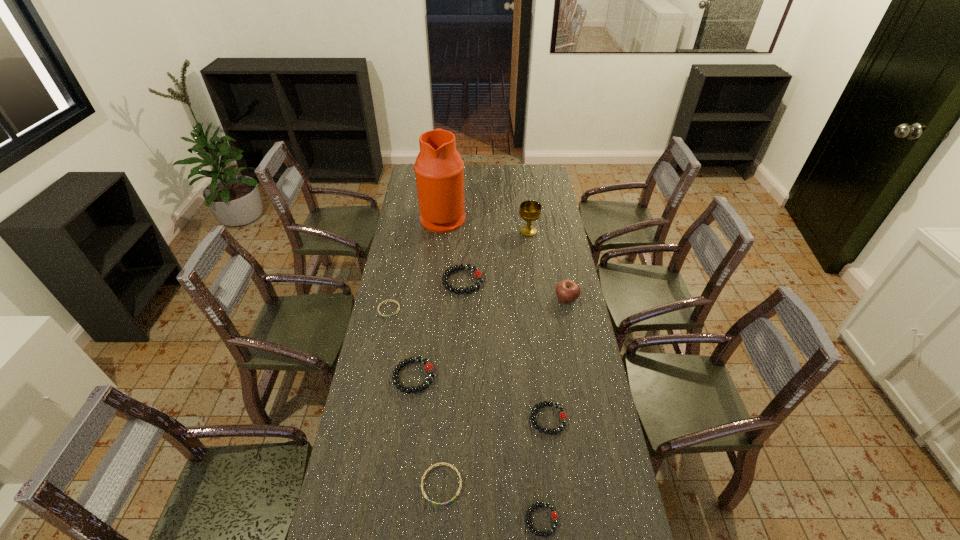
Locate an element on the screen. object identified as the fourth closest to the right blue bracelet is located at coordinates (390, 299).

Select which object appears as the third closest to the farthest black bracelet. Please provide its 2D coordinates. Your answer should be formatted as a tuple, i.e. [(x, y)], where the tuple contains the x and y coordinates of a point satisfying the conditions above.

[(530, 211)]

Where is `bracelet identified as the second closest to the fourth nearest bracelet`? bracelet identified as the second closest to the fourth nearest bracelet is located at coordinates (445, 464).

Locate an element on the screen. bracelet object that ranks as the fourth closest to the chalice is located at coordinates (563, 416).

Select which black bracelet is the closest to the sixth farthest object. Please provide its 2D coordinates. Your answer should be formatted as a tuple, i.e. [(x, y)], where the tuple contains the x and y coordinates of a point satisfying the conditions above.

[(563, 416)]

Select which black bracelet is the second closest to the nearest black bracelet. Please provide its 2D coordinates. Your answer should be formatted as a tuple, i.e. [(x, y)], where the tuple contains the x and y coordinates of a point satisfying the conditions above.

[(429, 368)]

I want to click on vacant space that satisfies the following two spatial constraints: 1. on the back side of the smallest black bracelet; 2. on the left side of the chalice, so click(515, 232).

You are a GUI agent. You are given a task and a screenshot of the screen. Output one action in this format:
    pyautogui.click(x=<x>, y=<y>)
    Task: Click on the blank space that satisfies the following two spatial constraints: 1. from the spout of the tallest object; 2. on the right side of the tallest bracelet
    This screenshot has width=960, height=540.
    Given the screenshot: What is the action you would take?
    pyautogui.click(x=437, y=281)